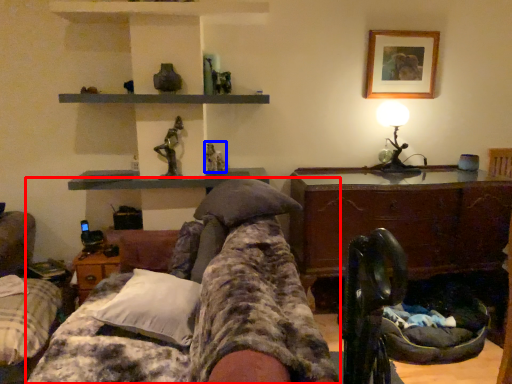
Question: Which point is closer to the camera, furniture (highlighted by a red box) or toy (highlighted by a blue box)?

Choices:
 (A) furniture
 (B) toy

Answer: (A)